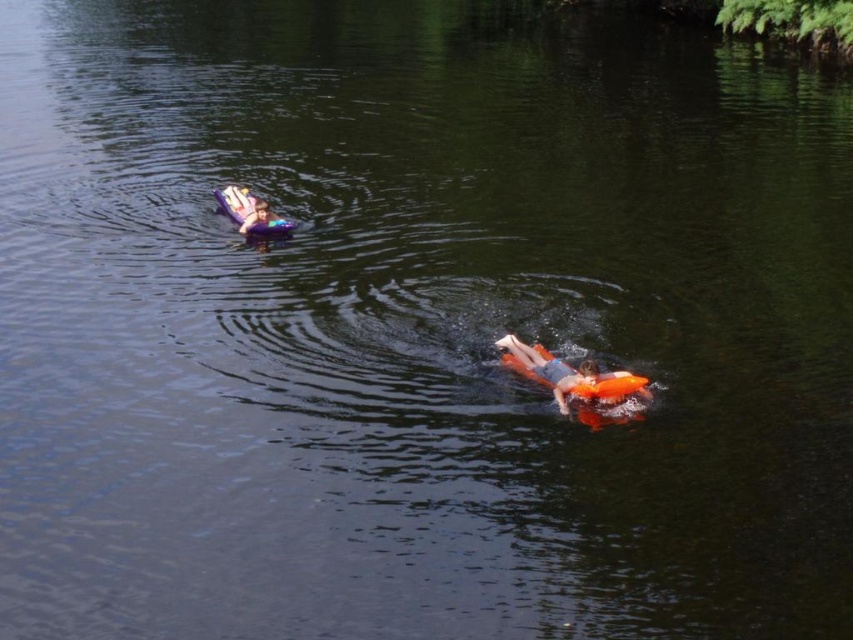
You are planning to take a short swim in the water and need to choose between the purple foam kayak at upper left and the orange life vest at upper center for safety. Which one would provide better buoyancy?

The purple foam kayak at upper left is larger in size than the orange life vest at upper center, so it would provide better buoyancy.

You are a lifeguard on duty and you see two orange items in the water. The orange foam at center and the orange life vest at upper center. Which one is bigger?

The orange foam at center is larger in size compared to the orange life vest at upper center.

You are planning to take a photo of the orange foam at center and the purple foam kayak at upper left. Which object should you focus on first if you want to capture both in the same frame without moving the camera?

The orange foam at center is shorter than the purple foam kayak at upper left, so you should focus on the orange foam at center first to ensure it is in focus before the taller purple foam kayak at upper left.